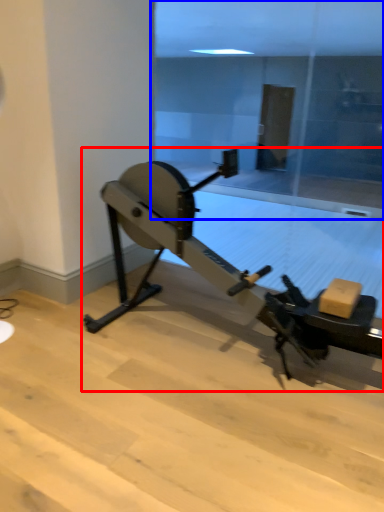
Question: Among these objects, which one is nearest to the camera, stationary bicycle (highlighted by a red box) or glass door (highlighted by a blue box)?

Choices:
 (A) stationary bicycle
 (B) glass door

Answer: (A)